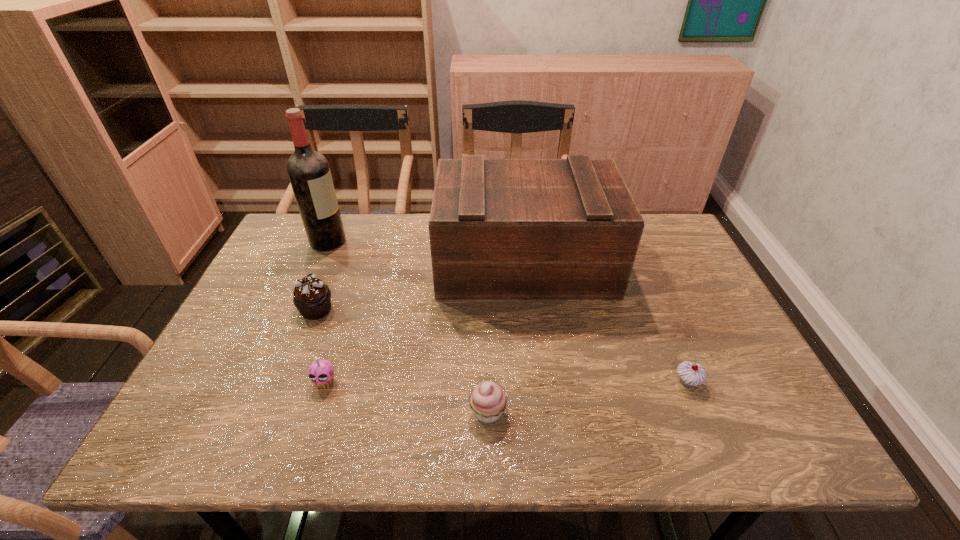
In the image, there is a desktop. Where is `vacant space at the near edge`? vacant space at the near edge is located at coordinates (413, 449).

Identify the location of blank area at the left edge. (268, 321).

The image size is (960, 540). I want to click on vacant space at the right edge of the desktop, so coord(684,340).

This screenshot has height=540, width=960. Identify the location of vacant space at the far left corner of the desktop. (276, 254).

You are a GUI agent. You are given a task and a screenshot of the screen. Output one action in this format:
    pyautogui.click(x=<x>, y=<y>)
    Task: Click on the blank space at the far right corner
    This screenshot has height=540, width=960.
    Given the screenshot: What is the action you would take?
    [663, 218]

The width and height of the screenshot is (960, 540). Identify the location of vacant space in between the second cupcake from right to left and the farthest cupcake. (402, 361).

Find the location of a particular element. The image size is (960, 540). vacant space that is in between the rightmost cupcake and the fourth object from right to left is located at coordinates (506, 382).

The width and height of the screenshot is (960, 540). In order to click on empty space between the third cupcake from left to right and the second tallest object in this screenshot , I will do `click(506, 337)`.

Find the location of a particular element. empty space that is in between the second cupcake from right to left and the rightmost object is located at coordinates (588, 397).

Where is `empty space that is in between the leftmost cupcake and the third cupcake from left to right`? The height and width of the screenshot is (540, 960). empty space that is in between the leftmost cupcake and the third cupcake from left to right is located at coordinates (402, 361).